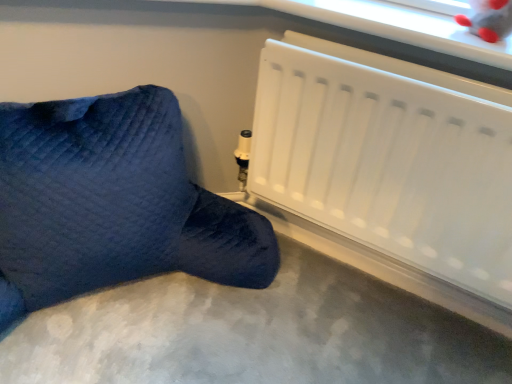
Question: Is white matte radiator at lower right not close to smooth gray carpet at lower center?

Choices:
 (A) no
 (B) yes

Answer: (A)

Question: Considering the relative sizes of white matte radiator at lower right and smooth gray carpet at lower center in the image provided, is white matte radiator at lower right thinner than smooth gray carpet at lower center?

Choices:
 (A) no
 (B) yes

Answer: (B)

Question: Is white matte radiator at lower right beside smooth gray carpet at lower center?

Choices:
 (A) yes
 (B) no

Answer: (B)

Question: Considering the relative sizes of white matte radiator at lower right and smooth gray carpet at lower center in the image provided, is white matte radiator at lower right taller than smooth gray carpet at lower center?

Choices:
 (A) yes
 (B) no

Answer: (A)

Question: Is white matte radiator at lower right aimed at smooth gray carpet at lower center?

Choices:
 (A) yes
 (B) no

Answer: (B)

Question: From the image's perspective, is smooth gray carpet at lower center above or below velvety blue bean bag at lower left?

Choices:
 (A) above
 (B) below

Answer: (B)

Question: Visually, is smooth gray carpet at lower center positioned to the left or to the right of velvety blue bean bag at lower left?

Choices:
 (A) left
 (B) right

Answer: (B)

Question: From a real-world perspective, relative to velvety blue bean bag at lower left, is smooth gray carpet at lower center vertically above or below?

Choices:
 (A) above
 (B) below

Answer: (B)

Question: Considering their positions, is smooth gray carpet at lower center located in front of or behind velvety blue bean bag at lower left?

Choices:
 (A) front
 (B) behind

Answer: (A)

Question: Considering the positions of velvety blue bean bag at lower left and smooth gray carpet at lower center in the image, is velvety blue bean bag at lower left bigger or smaller than smooth gray carpet at lower center?

Choices:
 (A) small
 (B) big

Answer: (B)

Question: In terms of width, does velvety blue bean bag at lower left look wider or thinner when compared to smooth gray carpet at lower center?

Choices:
 (A) wide
 (B) thin

Answer: (B)

Question: From the image's perspective, relative to smooth gray carpet at lower center, is velvety blue bean bag at lower left above or below?

Choices:
 (A) above
 (B) below

Answer: (A)

Question: Choose the correct answer: Is velvety blue bean bag at lower left inside smooth gray carpet at lower center or outside it?

Choices:
 (A) inside
 (B) outside

Answer: (B)

Question: From a real-world perspective, is white matte radiator at lower right above or below velvety blue bean bag at lower left?

Choices:
 (A) above
 (B) below

Answer: (A)

Question: Is white matte radiator at lower right spatially inside velvety blue bean bag at lower left, or outside of it?

Choices:
 (A) outside
 (B) inside

Answer: (A)